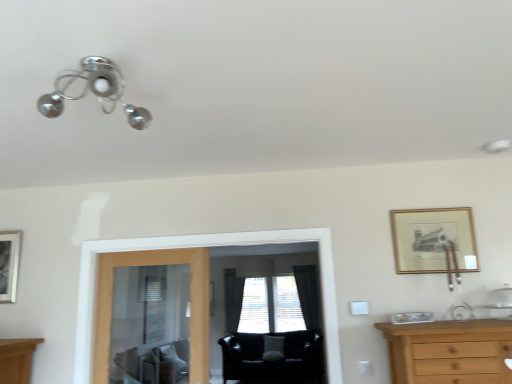
How much space does silver metallic picture frame at left, which ranks as the second picture frame in right-to-left order, occupy horizontally?

2.41 inches.

The image size is (512, 384). Describe the element at coordinates (270, 305) in the screenshot. I see `gray fabric window at center` at that location.

Find the location of a particular element. The height and width of the screenshot is (384, 512). black leather swivel chair at center is located at coordinates (273, 360).

Where is `black fabric curtain at center, which is counted as the 1th curtain, starting from the left`? black fabric curtain at center, which is counted as the 1th curtain, starting from the left is located at coordinates (233, 299).

How much space does black fabric curtain at center, which is counted as the second curtain, starting from the right, occupy vertically?

The height of black fabric curtain at center, which is counted as the second curtain, starting from the right, is 4.65 feet.

I want to click on clear glass door at center, so click(192, 302).

What do you see at coordinates (192, 302) in the screenshot? I see `clear glass door at center` at bounding box center [192, 302].

Find the location of a particular element. gold wooden picture frame at upper right, marked as the 1th picture frame in a front-to-back arrangement is located at coordinates (432, 239).

Is black fabric curtain at center, the first curtain positioned from the right, spatially inside clear glass door at center, or outside of it?

black fabric curtain at center, the first curtain positioned from the right, exists outside the volume of clear glass door at center.

What are the coordinates of `the 1st curtain behind the clear glass door at center` in the screenshot? It's located at (308, 295).

Is black leather swivel chair at center positioned with its back to transparent glass screen door at center?

No.

You are a GUI agent. You are given a task and a screenshot of the screen. Output one action in this format:
    pyautogui.click(x=<x>, y=<y>)
    Task: Click on the swivel chair below the transparent glass screen door at center (from a real-world perspective)
    The height and width of the screenshot is (384, 512).
    Given the screenshot: What is the action you would take?
    pyautogui.click(x=273, y=360)

Between black leather swivel chair at center and transparent glass screen door at center, which one is positioned in front?

transparent glass screen door at center is in front.

In the image, there is a black fabric curtain at center, the first curtain positioned from the right. Where is `window below it (from a real-world perspective)`? The image size is (512, 384). window below it (from a real-world perspective) is located at coordinates (270, 305).

Which is behind, gray fabric window at center or black fabric curtain at center, arranged as the second curtain when viewed from the left?

gray fabric window at center is more distant.

Considering the positions of objects gray fabric window at center and black fabric curtain at center, arranged as the second curtain when viewed from the left, in the image provided, who is more to the left, gray fabric window at center or black fabric curtain at center, arranged as the second curtain when viewed from the left,?

From the viewer's perspective, gray fabric window at center appears more on the left side.

Is point (229, 363) less distant than point (306, 313)?

Yes.

From the image's perspective, is black leather swivel chair at center on black fabric curtain at center, the first curtain positioned from the right?

No.

Identify the location of swivel chair below the black fabric curtain at center, arranged as the second curtain when viewed from the left (from the image's perspective). (273, 360).

Which is correct: black leather swivel chair at center is inside black fabric curtain at center, the first curtain positioned from the right, or outside of it?

The correct answer is: outside.

Measure the distance between gold wooden picture frame at upper right, marked as the 1th picture frame in a front-to-back arrangement, and gray fabric window at center.

A distance of 3.20 meters exists between gold wooden picture frame at upper right, marked as the 1th picture frame in a front-to-back arrangement, and gray fabric window at center.

Which of these two, gold wooden picture frame at upper right, which is counted as the 1th picture frame, starting from the right, or gray fabric window at center, is thinner?

gold wooden picture frame at upper right, which is counted as the 1th picture frame, starting from the right, is thinner.

Which is behind, point (406, 234) or point (270, 326)?

The point (270, 326) is more distant.

What's the angular difference between gold wooden picture frame at upper right, positioned as the 2th picture frame in back-to-front order, and gray fabric window at center's facing directions?

gold wooden picture frame at upper right, positioned as the 2th picture frame in back-to-front order, and gray fabric window at center are facing 0.855 degrees away from each other.

In the image, is gold wooden picture frame at upper right, which is counted as the 1th picture frame, starting from the right, on the left side or the right side of black leather swivel chair at center?

Clearly, gold wooden picture frame at upper right, which is counted as the 1th picture frame, starting from the right, is on the right of black leather swivel chair at center in the image.

Is gold wooden picture frame at upper right, marked as the 1th picture frame in a front-to-back arrangement, looking in the opposite direction of black leather swivel chair at center?

Yes.

Is gold wooden picture frame at upper right, which is counted as the 1th picture frame, starting from the right, located outside black leather swivel chair at center?

Absolutely, gold wooden picture frame at upper right, which is counted as the 1th picture frame, starting from the right, is external to black leather swivel chair at center.

Is gold wooden picture frame at upper right, which is counted as the 1th picture frame, starting from the right, in front of or behind black leather swivel chair at center in the image?

Clearly, gold wooden picture frame at upper right, which is counted as the 1th picture frame, starting from the right, is in front of black leather swivel chair at center.

From the image's perspective, which object appears higher, black fabric curtain at center, which is counted as the 1th curtain, starting from the left, or gold wooden picture frame at upper right, marked as the 1th picture frame in a front-to-back arrangement?

gold wooden picture frame at upper right, marked as the 1th picture frame in a front-to-back arrangement, is shown above in the image.

Which is in front, black fabric curtain at center, which is counted as the second curtain, starting from the right, or gold wooden picture frame at upper right, positioned as the 2th picture frame in back-to-front order?

gold wooden picture frame at upper right, positioned as the 2th picture frame in back-to-front order.

Who is shorter, black fabric curtain at center, which is counted as the second curtain, starting from the right, or gold wooden picture frame at upper right, positioned as the 2th picture frame in back-to-front order?

gold wooden picture frame at upper right, positioned as the 2th picture frame in back-to-front order.

At what (x,y) coordinates should I click in order to perform the action: click on the 2nd curtain behind when counting from the gold wooden picture frame at upper right, positioned as the 2th picture frame in back-to-front order. Please return your answer as a coordinate pair (x, y). Image resolution: width=512 pixels, height=384 pixels. Looking at the image, I should click on (233, 299).

From a real-world perspective, starting from the clear glass door at center, which curtain is the 2nd one vertically above it? Please provide its 2D coordinates.

[(308, 295)]

The height and width of the screenshot is (384, 512). What are the coordinates of `screen door on the left of black leather swivel chair at center` in the screenshot? It's located at (203, 246).

Considering their positions, is gray fabric window at center positioned further to silver metallic picture frame at left, which is the 2th picture frame in front-to-back order, than black fabric curtain at center, the first curtain positioned from the right?

black fabric curtain at center, the first curtain positioned from the right, is further to silver metallic picture frame at left, which is the 2th picture frame in front-to-back order.

Based on their spatial positions, is transparent glass screen door at center or clear glass door at center further from black fabric curtain at center, which is counted as the 1th curtain, starting from the left?

Based on the image, transparent glass screen door at center appears to be further to black fabric curtain at center, which is counted as the 1th curtain, starting from the left.

Looking at this image, which object lies further to the anchor point black fabric curtain at center, arranged as the second curtain when viewed from the left, black leather swivel chair at center or black fabric curtain at center, which is counted as the 1th curtain, starting from the left?

black fabric curtain at center, which is counted as the 1th curtain, starting from the left.

From the picture: Which object lies nearer to the anchor point black leather swivel chair at center, transparent glass screen door at center or black fabric curtain at center, which is counted as the second curtain, starting from the right?

black fabric curtain at center, which is counted as the second curtain, starting from the right, lies closer to black leather swivel chair at center than the other object.

Based on their spatial positions, is gold wooden picture frame at upper right, positioned as the 2th picture frame in back-to-front order, or black leather swivel chair at center closer to black fabric curtain at center, arranged as the second curtain when viewed from the left?

Based on the image, black leather swivel chair at center appears to be nearer to black fabric curtain at center, arranged as the second curtain when viewed from the left.

When comparing their distances from transparent glass screen door at center, does clear glass door at center or black fabric curtain at center, the first curtain positioned from the right, seem further?

black fabric curtain at center, the first curtain positioned from the right, is further to transparent glass screen door at center.

From the image, which object appears to be nearer to black leather swivel chair at center, gold wooden picture frame at upper right, which is counted as the 1th picture frame, starting from the right, or silver metallic picture frame at left, which ranks as the second picture frame in right-to-left order?

gold wooden picture frame at upper right, which is counted as the 1th picture frame, starting from the right, is closer to black leather swivel chair at center.

Based on the photo, when comparing their distances from black fabric curtain at center, which is counted as the second curtain, starting from the right, does clear glass door at center or gold wooden picture frame at upper right, which is counted as the 1th picture frame, starting from the right, seem further?

gold wooden picture frame at upper right, which is counted as the 1th picture frame, starting from the right.

Where is `window located between silver metallic picture frame at left, which appears as the first picture frame when viewed from the left, and black fabric curtain at center, which is counted as the second curtain, starting from the right, in the depth direction`? Image resolution: width=512 pixels, height=384 pixels. window located between silver metallic picture frame at left, which appears as the first picture frame when viewed from the left, and black fabric curtain at center, which is counted as the second curtain, starting from the right, in the depth direction is located at coordinates (270, 305).

Where is `curtain positioned between gold wooden picture frame at upper right, the second picture frame when ordered from left to right, and black fabric curtain at center, which is counted as the 1th curtain, starting from the left, from near to far`? The height and width of the screenshot is (384, 512). curtain positioned between gold wooden picture frame at upper right, the second picture frame when ordered from left to right, and black fabric curtain at center, which is counted as the 1th curtain, starting from the left, from near to far is located at coordinates (308, 295).

What are the coordinates of `swivel chair located between gold wooden picture frame at upper right, which is counted as the 1th picture frame, starting from the right, and black fabric curtain at center, the first curtain positioned from the right, in the depth direction` in the screenshot? It's located at (273, 360).

In order to click on picture frame between gold wooden picture frame at upper right, marked as the 1th picture frame in a front-to-back arrangement, and gray fabric window at center in the front-back direction in this screenshot , I will do `click(9, 264)`.